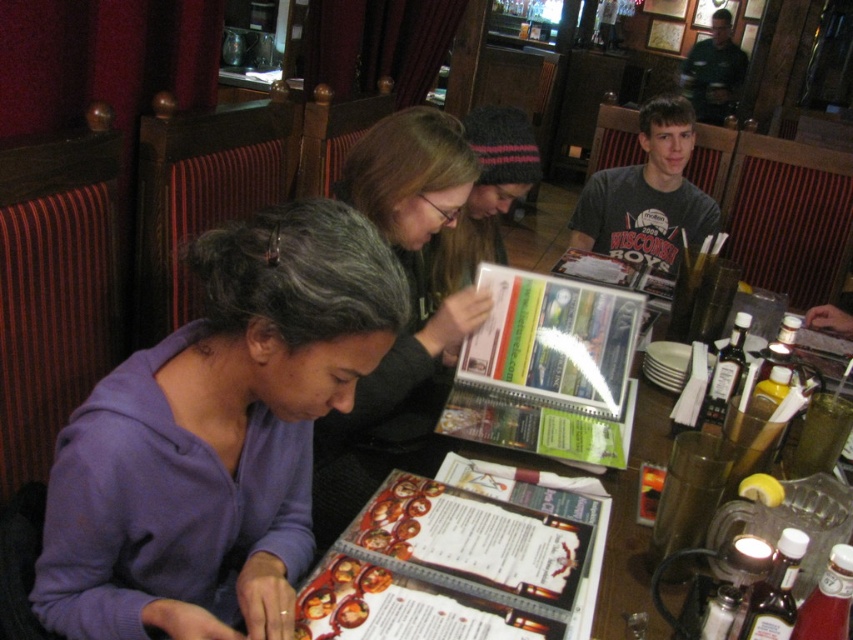
Between gray cotton shirt at upper right and green uniform shirt at upper right, which one appears on the left side from the viewer's perspective?

From the viewer's perspective, gray cotton shirt at upper right appears more on the left side.

Does gray cotton shirt at upper right appear on the right side of green uniform shirt at upper right?

In fact, gray cotton shirt at upper right is to the left of green uniform shirt at upper right.

Between point (614, 198) and point (706, 45), which one is positioned behind?

The point (706, 45) is more distant.

At what (x,y) coordinates should I click in order to perform the action: click on gray cotton shirt at upper right. Please return your answer as a coordinate pair (x, y). This screenshot has width=853, height=640. Looking at the image, I should click on point(647,195).

Does purple fleece jacket at lower left have a smaller size compared to printed paper menu at center?

No, purple fleece jacket at lower left is not smaller than printed paper menu at center.

Is purple fleece jacket at lower left below printed paper menu at center?

No, purple fleece jacket at lower left is not below printed paper menu at center.

Between point (260, 554) and point (437, 522), which one is positioned behind?

Point (437, 522)

You are a GUI agent. You are given a task and a screenshot of the screen. Output one action in this format:
    pyautogui.click(x=<x>, y=<y>)
    Task: Click on the purple fleece jacket at lower left
    This screenshot has height=640, width=853.
    Given the screenshot: What is the action you would take?
    [x=218, y=435]

Does matte black hair at center appear over green uniform shirt at upper right?

Actually, matte black hair at center is below green uniform shirt at upper right.

Which of these two, matte black hair at center or green uniform shirt at upper right, stands taller?

Standing taller between the two is green uniform shirt at upper right.

Identify the location of matte black hair at center. The height and width of the screenshot is (640, 853). (407, 282).

Locate an element on the screen. This screenshot has width=853, height=640. matte black hair at center is located at coordinates (407, 282).